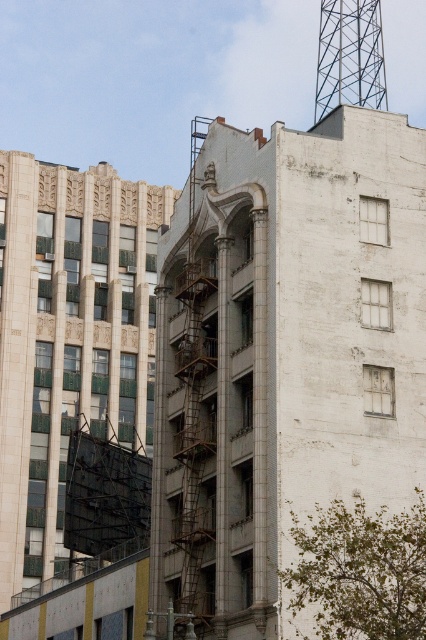
Question: Is beige stone tower at upper left further to camera compared to metallic lattice tower at upper right?

Choices:
 (A) yes
 (B) no

Answer: (B)

Question: Can you confirm if beige stone tower at upper left is smaller than metallic lattice tower at upper right?

Choices:
 (A) no
 (B) yes

Answer: (B)

Question: Is beige stone tower at upper left wider than metallic lattice tower at upper right?

Choices:
 (A) no
 (B) yes

Answer: (A)

Question: Which point is closer to the camera?

Choices:
 (A) (331, 440)
 (B) (356, 29)
 (C) (5, 308)

Answer: (A)

Question: Which object is positioned farthest from the metallic lattice tower at upper right?

Choices:
 (A) white concrete fire escape at upper center
 (B) beige stone tower at upper left

Answer: (A)

Question: Which point is farther to the camera?

Choices:
 (A) white concrete fire escape at upper center
 (B) metallic lattice tower at upper right
 (C) beige stone tower at upper left

Answer: (B)